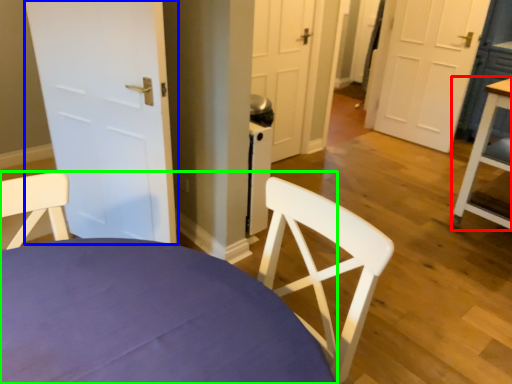
Question: Which object is positioned farthest from table (highlighted by a red box)? Select from door (highlighted by a blue box) and chair (highlighted by a green box).

Choices:
 (A) door
 (B) chair

Answer: (B)